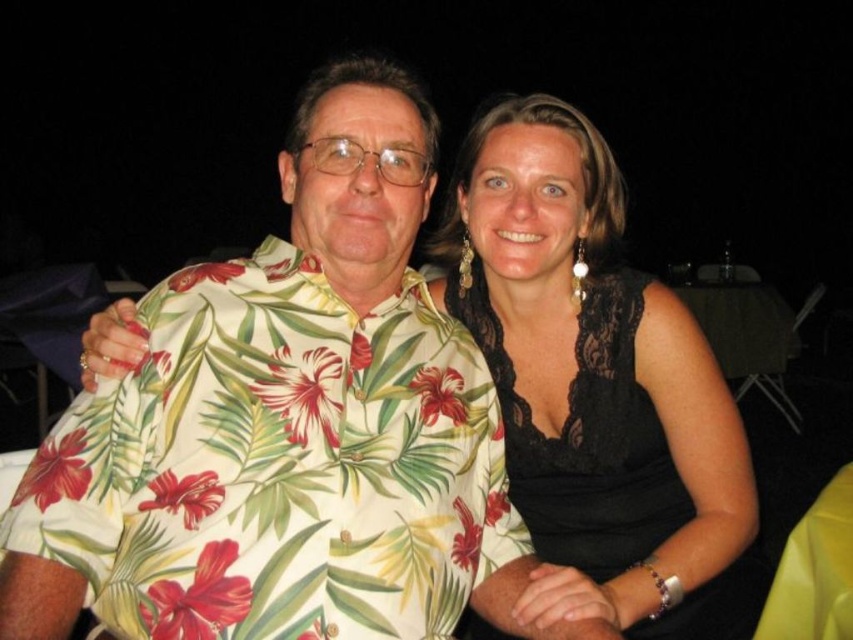
Question: Is floral print fabric shirt at center positioned at the back of black lace dress at center?

Choices:
 (A) yes
 (B) no

Answer: (B)

Question: Which of the following is the farthest from the observer?

Choices:
 (A) (527, 448)
 (B) (277, 467)

Answer: (A)

Question: Is floral print fabric shirt at center positioned in front of black lace dress at center?

Choices:
 (A) yes
 (B) no

Answer: (A)

Question: In this image, where is floral print fabric shirt at center located relative to black lace dress at center?

Choices:
 (A) above
 (B) below

Answer: (B)